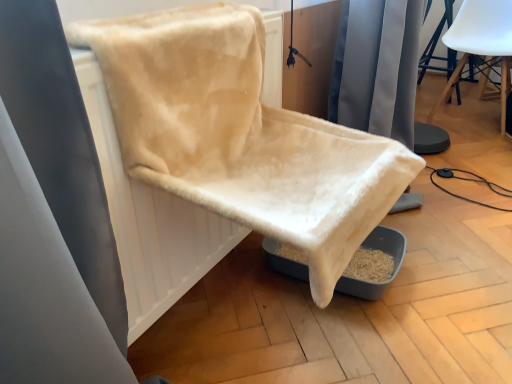
Question: From the image's perspective, is beige plush chair at center, which ranks as the 2th chair in top-to-bottom order, over beige fabric radiator at center?

Choices:
 (A) no
 (B) yes

Answer: (B)

Question: Considering the relative sizes of beige plush chair at center, which ranks as the 2th chair in top-to-bottom order, and beige fabric radiator at center in the image provided, is beige plush chair at center, which ranks as the 2th chair in top-to-bottom order, taller than beige fabric radiator at center?

Choices:
 (A) no
 (B) yes

Answer: (A)

Question: Can you confirm if beige plush chair at center, the 1th chair when ordered from bottom to top, is positioned to the left of beige fabric radiator at center?

Choices:
 (A) no
 (B) yes

Answer: (A)

Question: Considering the relative sizes of beige plush chair at center, the first chair viewed from the front, and beige fabric radiator at center in the image provided, is beige plush chair at center, the first chair viewed from the front, smaller than beige fabric radiator at center?

Choices:
 (A) no
 (B) yes

Answer: (A)

Question: From the image's perspective, is beige plush chair at center, the first chair viewed from the front, beneath beige fabric radiator at center?

Choices:
 (A) no
 (B) yes

Answer: (A)

Question: From a real-world perspective, does beige plush chair at center, which is counted as the second chair, starting from the right, stand above beige fabric radiator at center?

Choices:
 (A) yes
 (B) no

Answer: (A)

Question: Does white matte chair at upper right, acting as the first chair starting from the back, appear on the right side of beige plush chair at center, the 1th chair when ordered from bottom to top?

Choices:
 (A) yes
 (B) no

Answer: (A)

Question: From the image's perspective, is white matte chair at upper right, arranged as the 1th chair when viewed from the top, under beige plush chair at center, which is the second chair in back-to-front order?

Choices:
 (A) yes
 (B) no

Answer: (B)

Question: Is white matte chair at upper right, which is counted as the second chair, starting from the front, at the left side of beige plush chair at center, which is counted as the second chair, starting from the right?

Choices:
 (A) yes
 (B) no

Answer: (B)

Question: Is white matte chair at upper right, which is counted as the second chair, starting from the front, aimed at beige plush chair at center, the 1th chair in the left-to-right sequence?

Choices:
 (A) yes
 (B) no

Answer: (A)

Question: Can you confirm if white matte chair at upper right, which ranks as the 2th chair in left-to-right order, is wider than beige plush chair at center, the 1th chair in the left-to-right sequence?

Choices:
 (A) yes
 (B) no

Answer: (B)

Question: Is white matte chair at upper right, the 2th chair ordered from the bottom, not within beige plush chair at center, which ranks as the 2th chair in top-to-bottom order?

Choices:
 (A) yes
 (B) no

Answer: (A)

Question: Considering the relative sizes of white matte chair at upper right, which is the 1th chair in right-to-left order, and beige fabric radiator at center in the image provided, is white matte chair at upper right, which is the 1th chair in right-to-left order, bigger than beige fabric radiator at center?

Choices:
 (A) yes
 (B) no

Answer: (A)